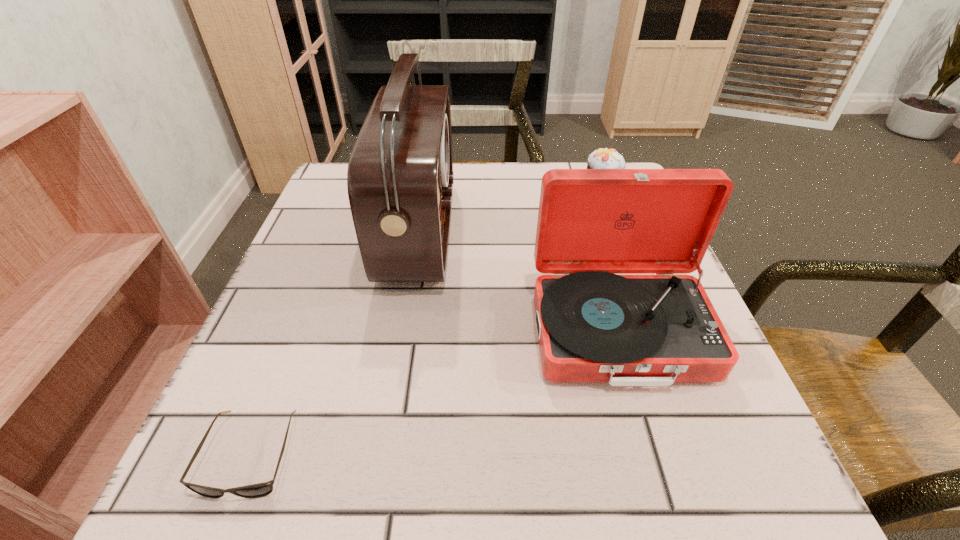
The height and width of the screenshot is (540, 960). In order to click on blank space at the far left corner in this screenshot , I will do `click(338, 174)`.

You are a GUI agent. You are given a task and a screenshot of the screen. Output one action in this format:
    pyautogui.click(x=<x>, y=<y>)
    Task: Click on the free space at the near left corner of the desktop
    
    Given the screenshot: What is the action you would take?
    pyautogui.click(x=199, y=499)

This screenshot has height=540, width=960. Find the location of `free spot between the radio receiver and the nearest object`. free spot between the radio receiver and the nearest object is located at coordinates (335, 343).

In order to click on free spot between the sunglasses and the radio receiver in this screenshot , I will do `click(335, 343)`.

Locate an element on the screen. Image resolution: width=960 pixels, height=540 pixels. empty space that is in between the phonograph_record and the nearest object is located at coordinates (435, 394).

This screenshot has height=540, width=960. I want to click on empty space that is in between the phonograph_record and the shortest object, so click(x=435, y=394).

Locate an element on the screen. The width and height of the screenshot is (960, 540). free space between the leftmost object and the third tallest object is located at coordinates (426, 320).

I want to click on blank region between the shortest object and the second object from left to right, so (x=335, y=343).

I want to click on vacant area between the cupcake and the tallest object, so click(x=511, y=208).

Locate an element on the screen. This screenshot has height=540, width=960. free spot between the shortest object and the cupcake is located at coordinates 426,320.